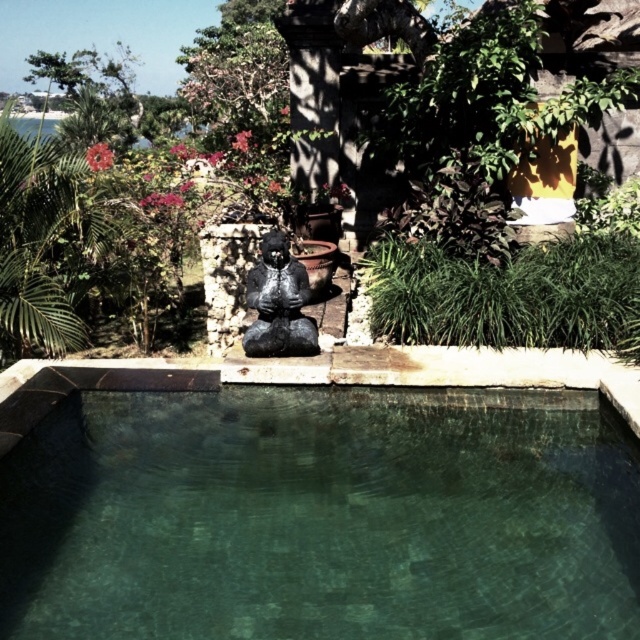
You are a maintenance worker tasked with cleaning the pool. You have a 1.2 meter wide cleaning tool. Can you move the tool through the space between the green mosaic tiles at center and the black matte statue at center?

The green mosaic tiles at center might be wider than black matte statue at center, so the space between them is uncertain. It is safer to measure the distance before moving the tool through.

You are standing at the edge of the pool and want to determine which of the two points, point (572, 278) or point (273, 228), is closer to you. Based on the scene description, which point is nearer?

Point (572, 278) is closer to the viewer than point (273, 228).

You are a gardener who needs to water the green leafy plant at center and the black matte statue at center. Since the statue is in the way, can you water the plant without moving the statue?

The green leafy plant at center is positioned over black matte statue at center, so you can water the plant without moving the statue because the plant is above the statue and accessible from the sides or front.